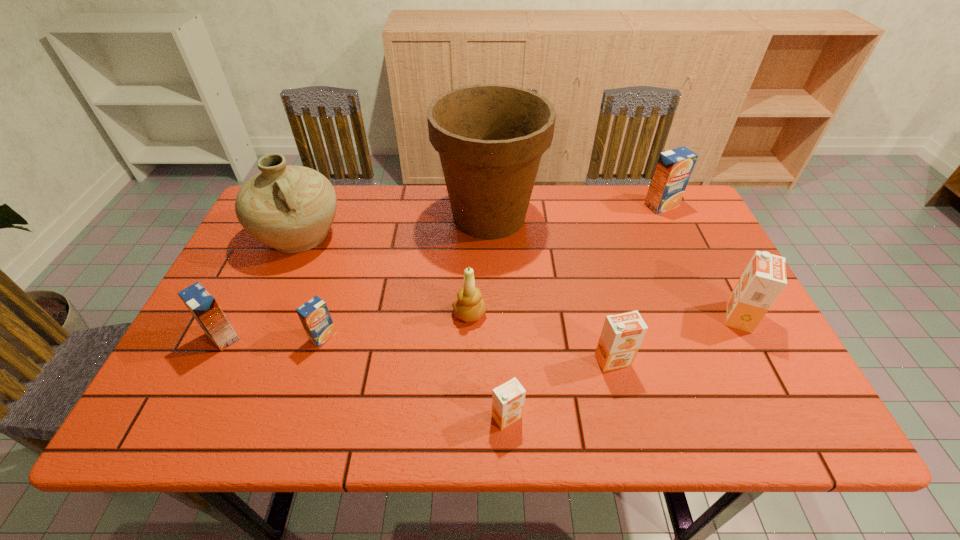
Where is `flowerpot`? The width and height of the screenshot is (960, 540). flowerpot is located at coordinates (490, 137).

Locate an element on the screen. This screenshot has width=960, height=540. the second tallest object is located at coordinates (290, 208).

Locate an element on the screen. the farthest blue orange_juice is located at coordinates (674, 167).

Locate an element on the screen. This screenshot has height=540, width=960. the farthest orange juice is located at coordinates (674, 167).

Where is `the biggest orange orange juice`? Image resolution: width=960 pixels, height=540 pixels. the biggest orange orange juice is located at coordinates (764, 278).

You are a GUI agent. You are given a task and a screenshot of the screen. Output one action in this format:
    pyautogui.click(x=<x>, y=<y>)
    Task: Click on the rightmost orange orange juice
    This screenshot has height=540, width=960.
    Given the screenshot: What is the action you would take?
    pyautogui.click(x=764, y=278)

Locate an element on the screen. candle_holder is located at coordinates (470, 306).

Find the location of `the leftmost orange juice`. the leftmost orange juice is located at coordinates (202, 305).

Find the location of a particular element. This screenshot has width=960, height=540. the leftmost blue orange_juice is located at coordinates (202, 305).

This screenshot has height=540, width=960. In order to click on the third orange juice from right to left in this screenshot , I will do `click(622, 334)`.